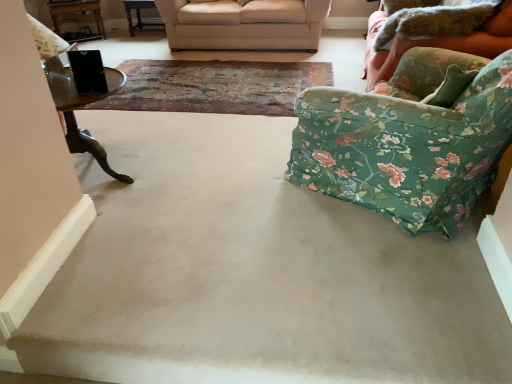
Where is `free space to the left of floral fabric armchair at right`? The image size is (512, 384). free space to the left of floral fabric armchair at right is located at coordinates (229, 170).